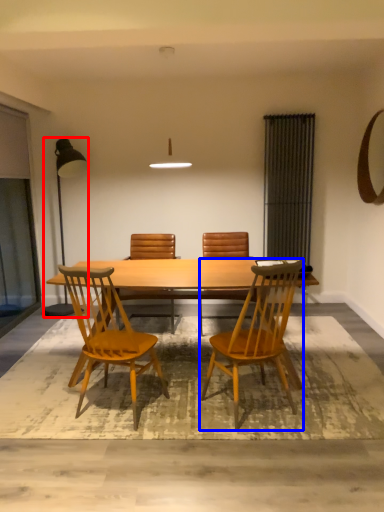
Question: Among these objects, which one is nearest to the camera, lamp (highlighted by a red box) or chair (highlighted by a blue box)?

Choices:
 (A) lamp
 (B) chair

Answer: (B)